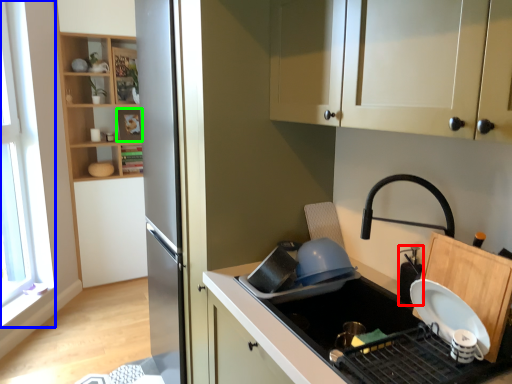
Question: Which is farther away from appliance (highlighted by a red box)? window (highlighted by a blue box) or shelf (highlighted by a green box)?

Choices:
 (A) window
 (B) shelf

Answer: (B)